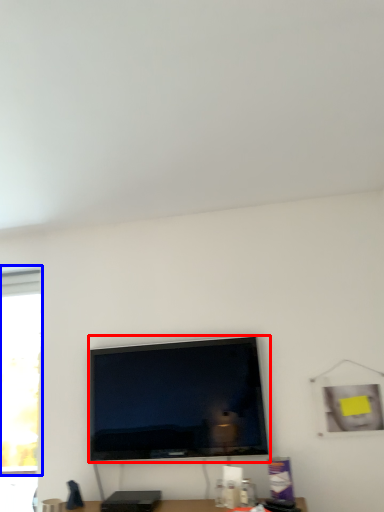
Question: Which object appears closest to the camera in this image, television (highlighted by a red box) or window (highlighted by a blue box)?

Choices:
 (A) television
 (B) window

Answer: (A)